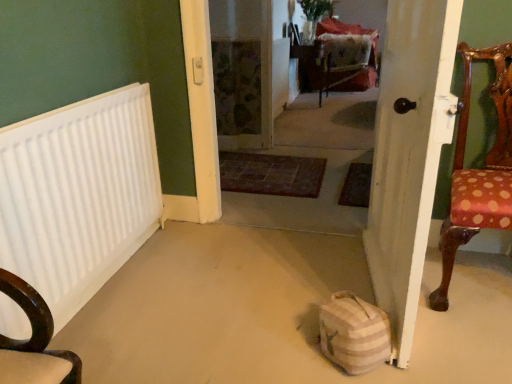
Identify the location of free space between white wooden door at right and white matte radiator at left. (224, 294).